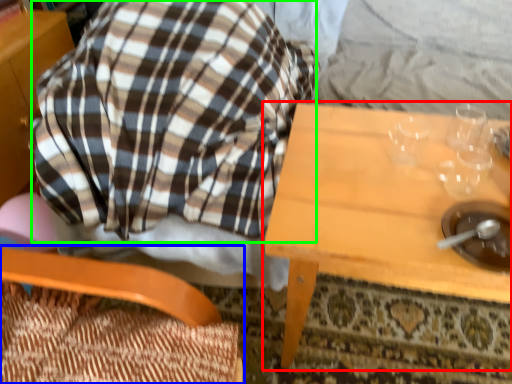
Question: Which is farther away from table (highlighted by a red box)? chair (highlighted by a blue box) or flannel (highlighted by a green box)?

Choices:
 (A) chair
 (B) flannel

Answer: (A)